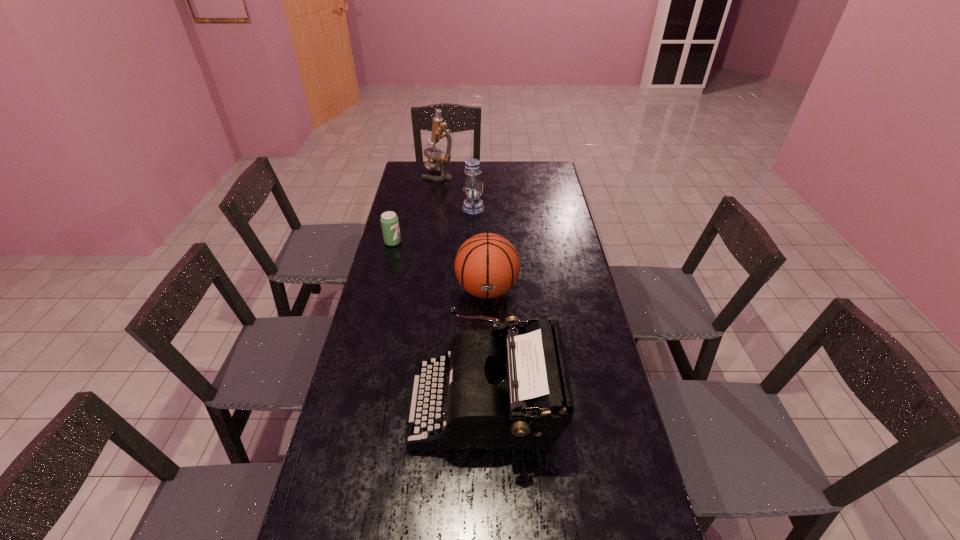
At what (x,y) coordinates should I click in order to perform the action: click on microscope. Please return your answer as a coordinate pair (x, y). The image size is (960, 540). Looking at the image, I should click on (439, 130).

At what (x,y) coordinates should I click in order to perform the action: click on the farthest object. Please return your answer as a coordinate pair (x, y). The image size is (960, 540). Looking at the image, I should click on (439, 130).

In order to click on the second farthest object in this screenshot , I will do `click(472, 205)`.

The height and width of the screenshot is (540, 960). Identify the location of basketball. (487, 265).

Where is `the second nearest object`? The image size is (960, 540). the second nearest object is located at coordinates (517, 396).

The height and width of the screenshot is (540, 960). I want to click on the third farthest object, so click(x=389, y=220).

At what (x,y) coordinates should I click in order to perform the action: click on the leftmost object. Please return your answer as a coordinate pair (x, y). Looking at the image, I should click on (389, 220).

Where is `vacant space situated 0.240m on the right of the microscope`? This screenshot has width=960, height=540. vacant space situated 0.240m on the right of the microscope is located at coordinates (503, 175).

Locate an element on the screen. The height and width of the screenshot is (540, 960). vacant space situated 0.290m on the front-facing side of the fifth nearest object is located at coordinates (551, 208).

Image resolution: width=960 pixels, height=540 pixels. Identify the location of vacant space located on the side where the inflation valve is located. (489, 384).